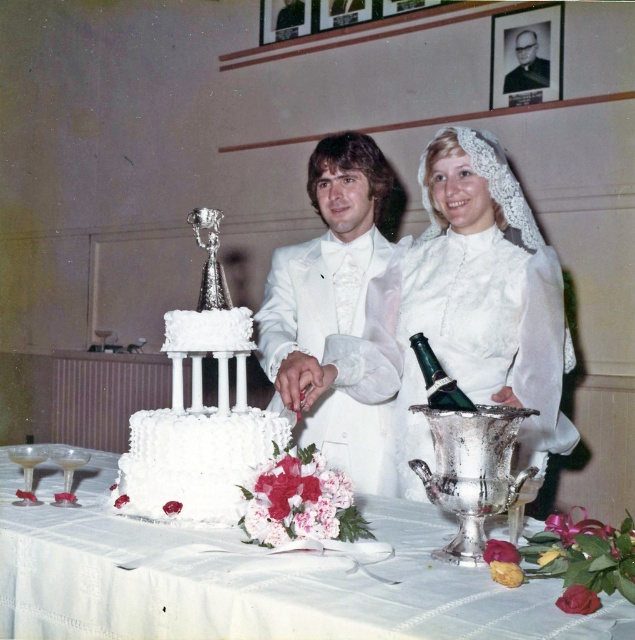
Is point (577, 634) farther from camera compared to point (458, 388)?

No, it is in front of (458, 388).

Does white fabric tablecloth at center have a smaller size compared to green glass bottle at center?

Incorrect, white fabric tablecloth at center is not smaller in size than green glass bottle at center.

Who is more forward, [237,538] or [462,390]?

Point [237,538] is in front.

Where is `white fabric tablecloth at center`? white fabric tablecloth at center is located at coordinates (251, 579).

Based on the photo, can you confirm if white fabric tablecloth at center is positioned to the left of white frosted cake at center?

In fact, white fabric tablecloth at center is to the right of white frosted cake at center.

In the scene shown: Who is positioned more to the right, white fabric tablecloth at center or white frosted cake at center?

Positioned to the right is white fabric tablecloth at center.

Which is in front, point (112, 596) or point (199, 234)?

Point (112, 596)

The image size is (635, 640). In order to click on white fabric tablecloth at center in this screenshot , I will do `click(251, 579)`.

Is point (340, 224) in front of point (203, 419)?

No, (340, 224) is behind (203, 419).

Does white satin tuxedo at center have a greater width compared to white textured cake at center?

Correct, the width of white satin tuxedo at center exceeds that of white textured cake at center.

Where is `white satin tuxedo at center`? This screenshot has height=640, width=635. white satin tuxedo at center is located at coordinates (330, 301).

Locate an element on the screen. Image resolution: width=635 pixels, height=640 pixels. white satin tuxedo at center is located at coordinates (330, 301).